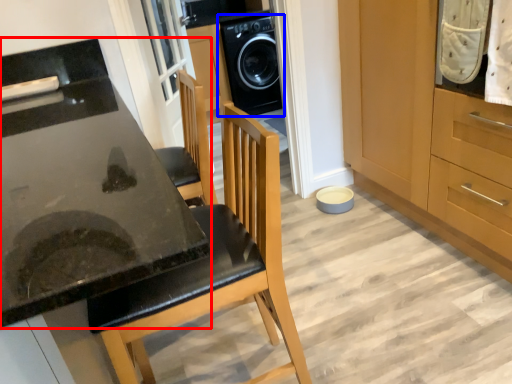
Question: Among these objects, which one is farthest to the camera, countertop (highlighted by a red box) or home appliance (highlighted by a blue box)?

Choices:
 (A) countertop
 (B) home appliance

Answer: (B)